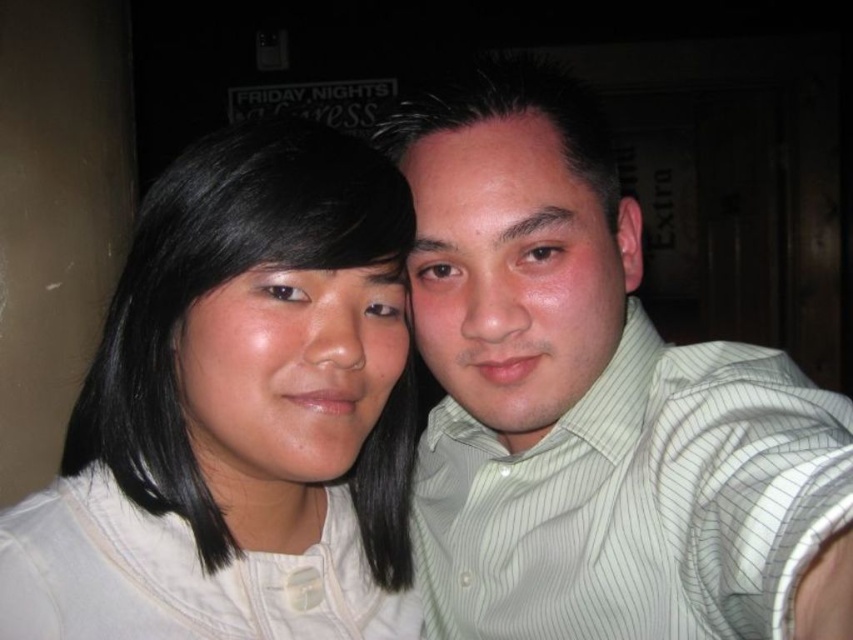
You are a photographer trying to adjust the focus between the white matte shirt at left and the matte white face at center in a photo. The camera can only focus on objects within a 4.5 cm distance range. Can both objects be in focus at the same time?

The distance between the white matte shirt at left and the matte white face at center is 4.36 centimeters, which is within the camera focus range of 4.5 cm. Therefore, both objects can be in focus simultaneously.

Consider the image. You are a photographer trying to adjust the lighting for a group photo. You notice the green striped shirt at right and the matte white face at center in your frame. Which object will require more light to ensure it appears properly exposed in the final image?

The green striped shirt at right has a larger size compared to matte white face at center, so it will require more light to ensure it appears properly exposed in the final image.